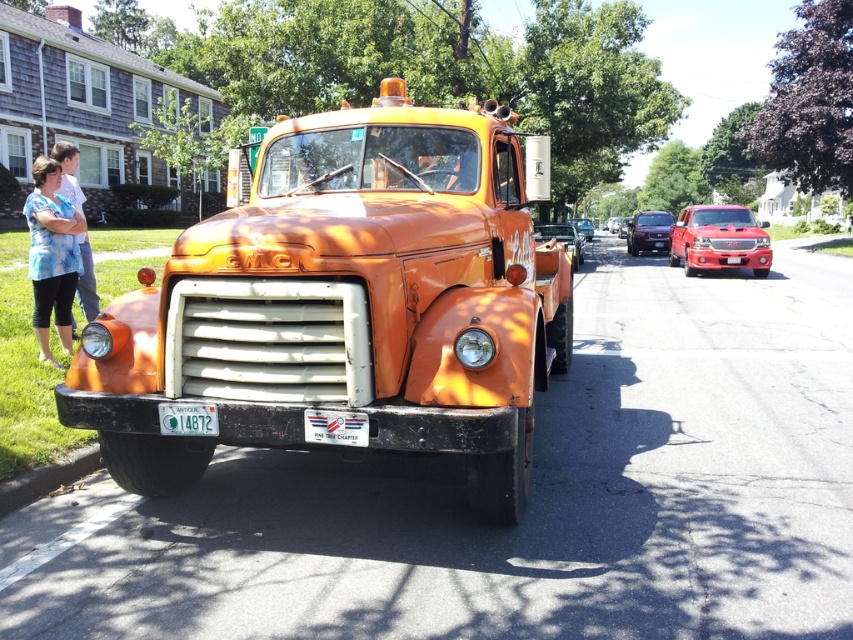
Question: Is orange matte tow truck at center positioned in front of glossy red truck at center?

Choices:
 (A) yes
 (B) no

Answer: (A)

Question: Can you confirm if green plastic license plate at center is positioned to the left of shiny silver sedan at center?

Choices:
 (A) no
 (B) yes

Answer: (B)

Question: Is orange matte tow truck at center in front of white plastic license plate at center?

Choices:
 (A) yes
 (B) no

Answer: (A)

Question: Which object is farther from the camera taking this photo?

Choices:
 (A) green plastic license plate at center
 (B) blue printed shirt at left
 (C) shiny silver sedan at center

Answer: (C)

Question: Which of the following is the closest to the observer?

Choices:
 (A) blue printed shirt at left
 (B) white plastic license plate at center

Answer: (A)

Question: Which object is positioned closest to the blue tie-dye shirt at left?

Choices:
 (A) metallic silver sedan at center
 (B) white plastic license plate at center
 (C) glossy red truck at center
 (D) glossy maroon sedan at center

Answer: (B)